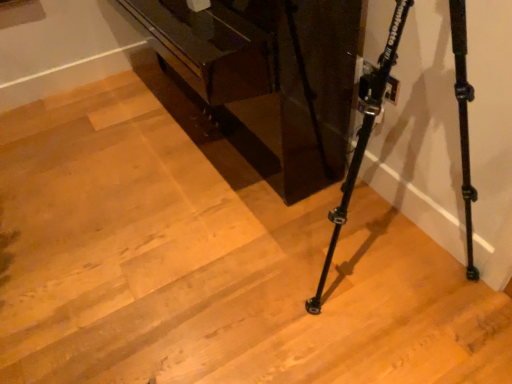
In order to click on vacant space in glossy dark wood piano at center (from a real-world perspective) in this screenshot , I will do tap(193, 134).